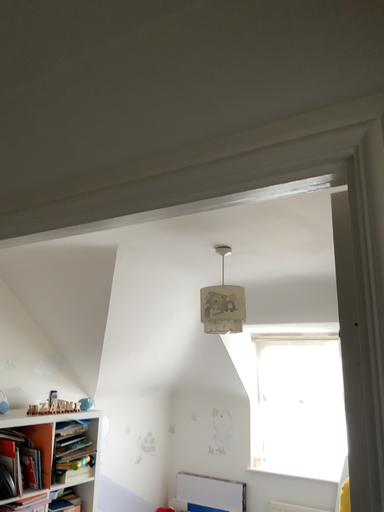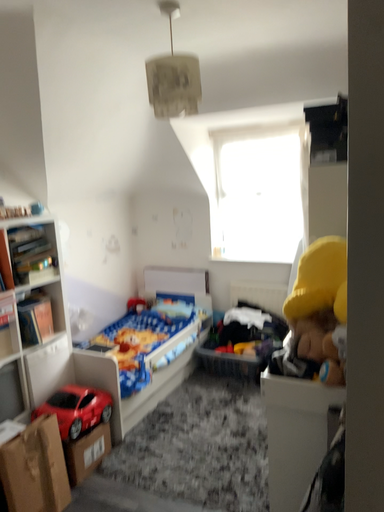
Question: Which way did the camera rotate in the video?

Choices:
 (A) rotated right
 (B) rotated left

Answer: (A)